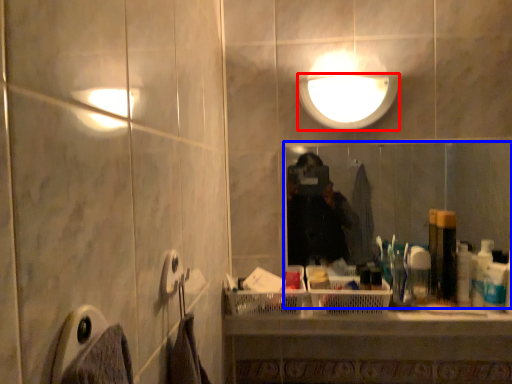
Question: Which object is closer to the camera taking this photo, light fixture (highlighted by a red box) or mirror (highlighted by a blue box)?

Choices:
 (A) light fixture
 (B) mirror

Answer: (A)